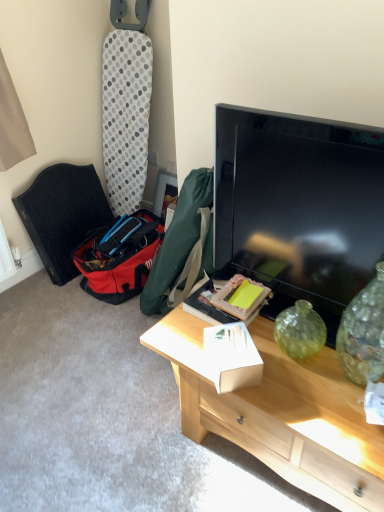
Question: Should I look upward or downward to see wooden picture frame at center?

Choices:
 (A) down
 (B) up

Answer: (B)

Question: Is light wood desk at center taller than white cardboard box at center, which ranks as the 1th box in back-to-front order?

Choices:
 (A) no
 (B) yes

Answer: (B)

Question: From a real-world perspective, is light wood desk at center positioned under white cardboard box at center, which ranks as the 1th box in back-to-front order, based on gravity?

Choices:
 (A) yes
 (B) no

Answer: (A)

Question: Is light wood desk at center outside white cardboard box at center, which ranks as the 1th box in back-to-front order?

Choices:
 (A) no
 (B) yes

Answer: (B)

Question: From the image's perspective, would you say light wood desk at center is positioned over white cardboard box at center, which ranks as the 1th box in back-to-front order?

Choices:
 (A) no
 (B) yes

Answer: (A)

Question: Can you confirm if light wood desk at center is thinner than white cardboard box at center, which ranks as the 1th box in back-to-front order?

Choices:
 (A) yes
 (B) no

Answer: (B)

Question: Does light wood desk at center come behind white cardboard box at center, acting as the second box starting from the front?

Choices:
 (A) yes
 (B) no

Answer: (B)

Question: Does light wood desk at center have a larger size compared to wooden picture frame at center?

Choices:
 (A) no
 (B) yes

Answer: (B)

Question: Is light wood desk at center to the right of wooden picture frame at center from the viewer's perspective?

Choices:
 (A) yes
 (B) no

Answer: (A)

Question: From a real-world perspective, does light wood desk at center stand above wooden picture frame at center?

Choices:
 (A) no
 (B) yes

Answer: (A)

Question: Is the position of light wood desk at center less distant than that of wooden picture frame at center?

Choices:
 (A) yes
 (B) no

Answer: (A)

Question: Is the surface of light wood desk at center in direct contact with wooden picture frame at center?

Choices:
 (A) yes
 (B) no

Answer: (B)

Question: From a real-world perspective, does light wood desk at center sit lower than wooden picture frame at center?

Choices:
 (A) yes
 (B) no

Answer: (A)

Question: From a real-world perspective, is wooden picture frame at center positioned under white cardboard box at center, arranged as the first box when viewed from the front, based on gravity?

Choices:
 (A) yes
 (B) no

Answer: (A)